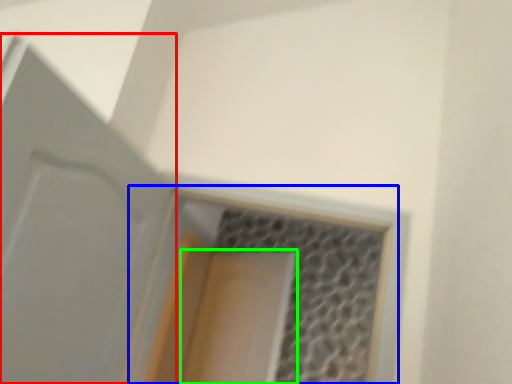
Question: Which is nearer to the door (highlighted by a red box)? window (highlighted by a blue box) or screen door (highlighted by a green box).

Choices:
 (A) window
 (B) screen door

Answer: (A)